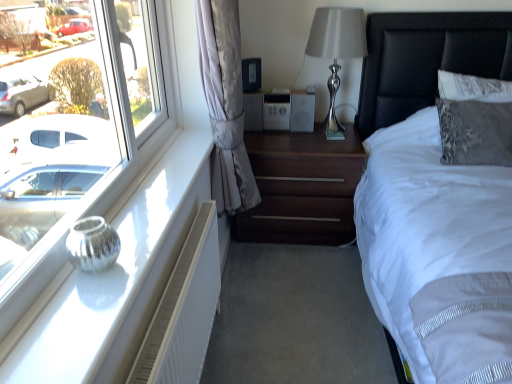
Identify the location of vacant area on top of silver metallic vase at left (from a real-world perspective). (129, 226).